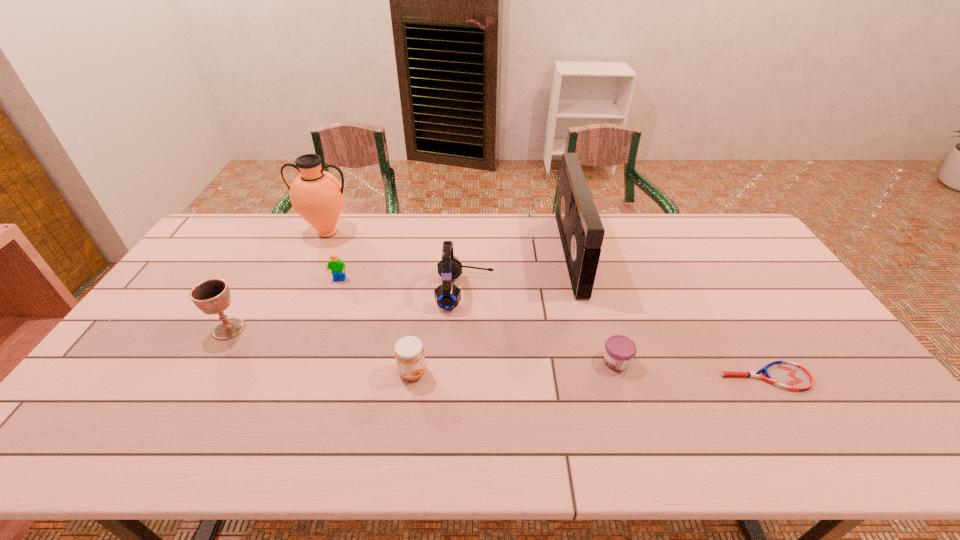
Where is `pitcher`? pitcher is located at coordinates (317, 196).

Where is `videotape`? This screenshot has width=960, height=540. videotape is located at coordinates (581, 231).

In order to click on the fourth object from right to left in this screenshot , I will do `click(447, 295)`.

Where is `the sixth shortest object`? The image size is (960, 540). the sixth shortest object is located at coordinates (447, 295).

At what (x,y) coordinates should I click in order to perform the action: click on chalice. Please return your answer as a coordinate pair (x, y). The width and height of the screenshot is (960, 540). Looking at the image, I should click on (212, 296).

The image size is (960, 540). Identify the location of the fourth nearest object. (212, 296).

Identify the location of Lego. The width and height of the screenshot is (960, 540). (337, 267).

Locate an element on the screen. the taller jam is located at coordinates (409, 353).

Image resolution: width=960 pixels, height=540 pixels. I want to click on the left jam, so click(x=409, y=353).

Identify the location of the shorter jam. (619, 350).